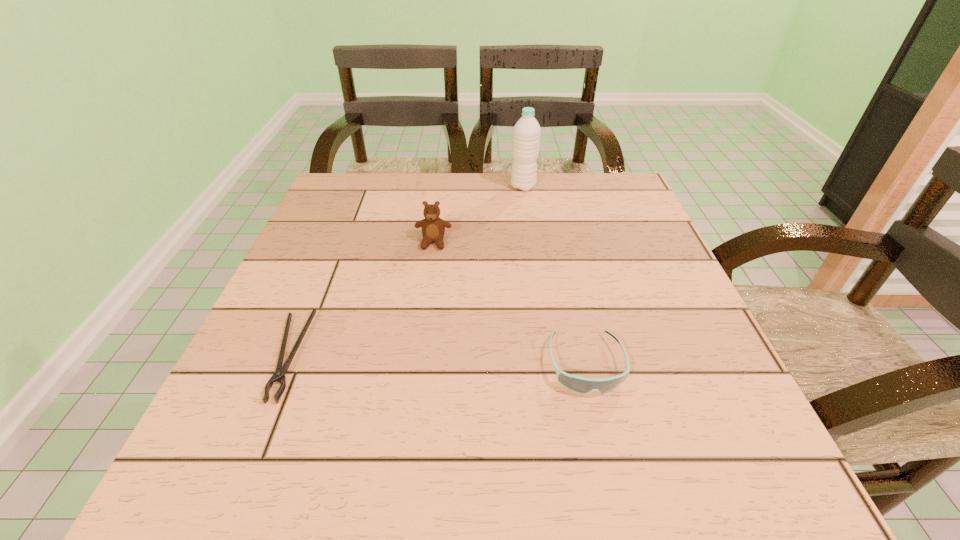
Where is `the tallest object`? Image resolution: width=960 pixels, height=540 pixels. the tallest object is located at coordinates (526, 137).

Locate an element on the screen. This screenshot has width=960, height=540. the farthest object is located at coordinates (526, 137).

Locate an element on the screen. The width and height of the screenshot is (960, 540). the third object from right to left is located at coordinates (433, 228).

Find the location of `the third nearest object`. the third nearest object is located at coordinates (433, 228).

At what (x,y) coordinates should I click in order to perform the action: click on the second shortest object. Please return your answer as a coordinate pair (x, y). The height and width of the screenshot is (540, 960). Looking at the image, I should click on pyautogui.click(x=581, y=385).

Image resolution: width=960 pixels, height=540 pixels. I want to click on the shortest object, so click(x=279, y=375).

Find the location of a particular element. The height and width of the screenshot is (540, 960). the leftmost object is located at coordinates (279, 375).

Locate an element on the screen. vacant space situated on the left of the farthest object is located at coordinates (433, 186).

The height and width of the screenshot is (540, 960). I want to click on free space located 0.070m at the face of the second farthest object, so click(430, 272).

You are a GUI agent. You are given a task and a screenshot of the screen. Output one action in this format:
    pyautogui.click(x=<x>, y=<y>)
    Task: Click on the free space located 0.160m on the front-facing side of the second shortest object
    
    Given the screenshot: What is the action you would take?
    pyautogui.click(x=617, y=505)